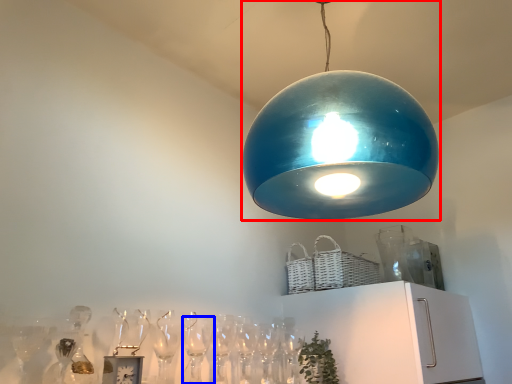
Question: Which object appears closest to the camera in this image, lamp (highlighted by a red box) or wine glass (highlighted by a blue box)?

Choices:
 (A) lamp
 (B) wine glass

Answer: (A)